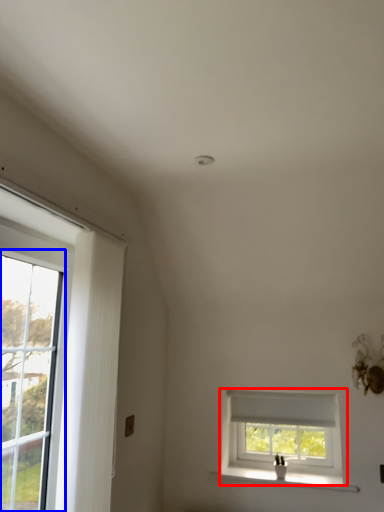
Question: Which point is further to the camera, window (highlighted by a red box) or glass door (highlighted by a blue box)?

Choices:
 (A) window
 (B) glass door

Answer: (A)